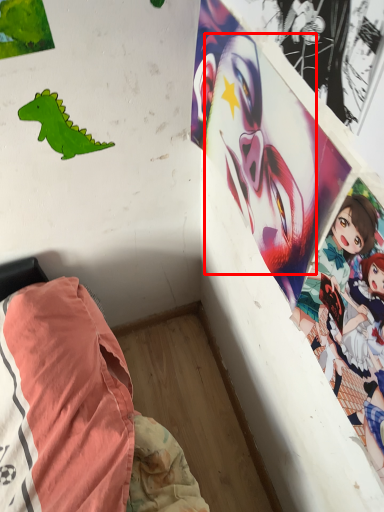
Question: From the image's perspective, where is human face (annotated by the red box) located relative to dinosaur?

Choices:
 (A) above
 (B) below

Answer: (B)